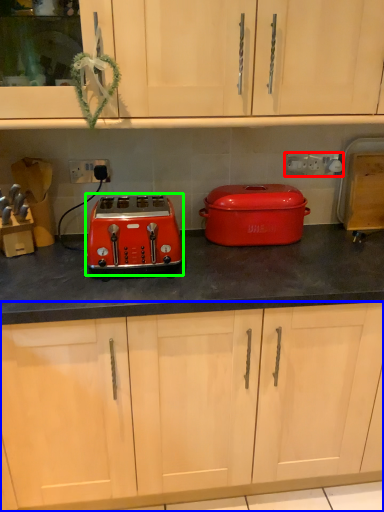
Question: Which object is positioned closest to electric outlet (highlighted by a red box)? Select from cabinetry (highlighted by a blue box) and toaster (highlighted by a green box).

Choices:
 (A) cabinetry
 (B) toaster

Answer: (B)